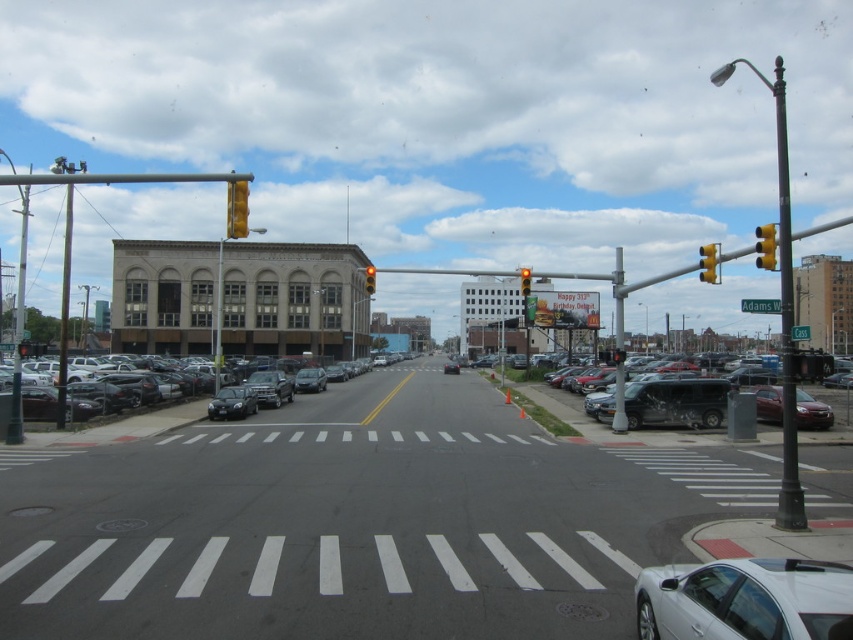
You are a pedestrian standing at the intersection and want to walk to the point marked as point (828, 410) and point (527, 275). Which point is closer to you?

Point (527, 275) is closer to you because it is less further than point (828, 410).

You are a pedestrian standing at the crosswalk in the image. You see a white glossy sedan at lower right and a metallic pole at right. Which object is closer to you?

The white glossy sedan at lower right is smaller than the metallic pole at right, so it is closer to you.